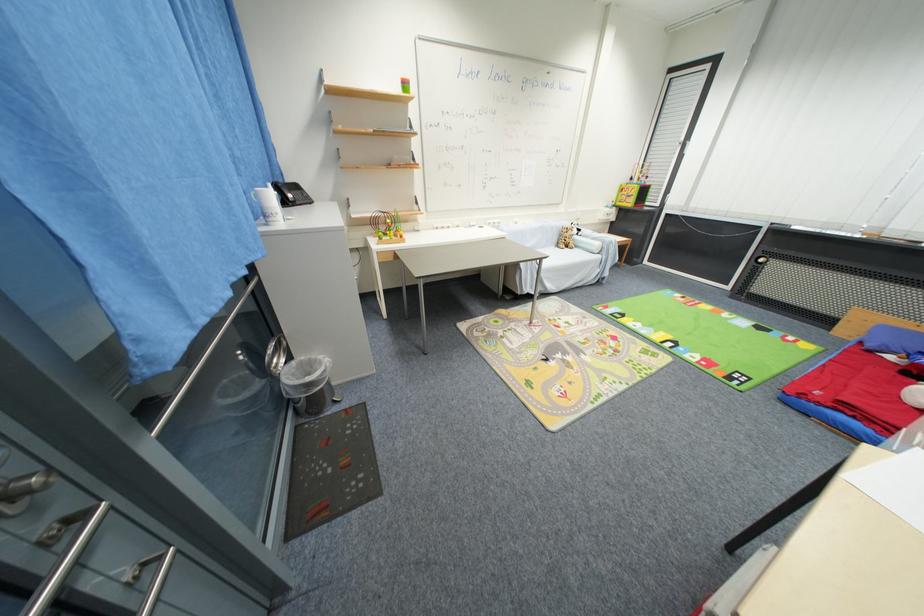
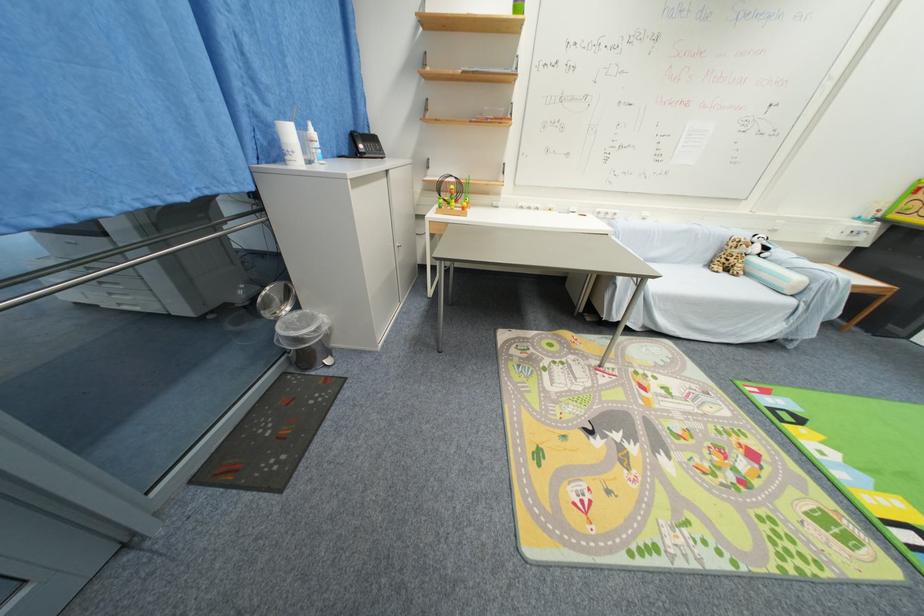
Locate, in the second image, the point that corresponds to (x=563, y=246) in the first image.

(714, 265)